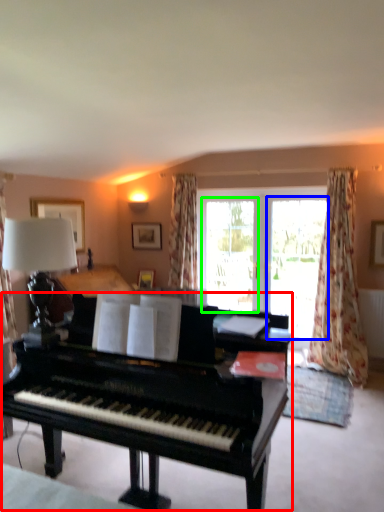
Question: Which object is positioned farthest from piano (highlighted by a red box)? Select from screen door (highlighted by a blue box) and screen door (highlighted by a green box).

Choices:
 (A) screen door
 (B) screen door

Answer: (B)